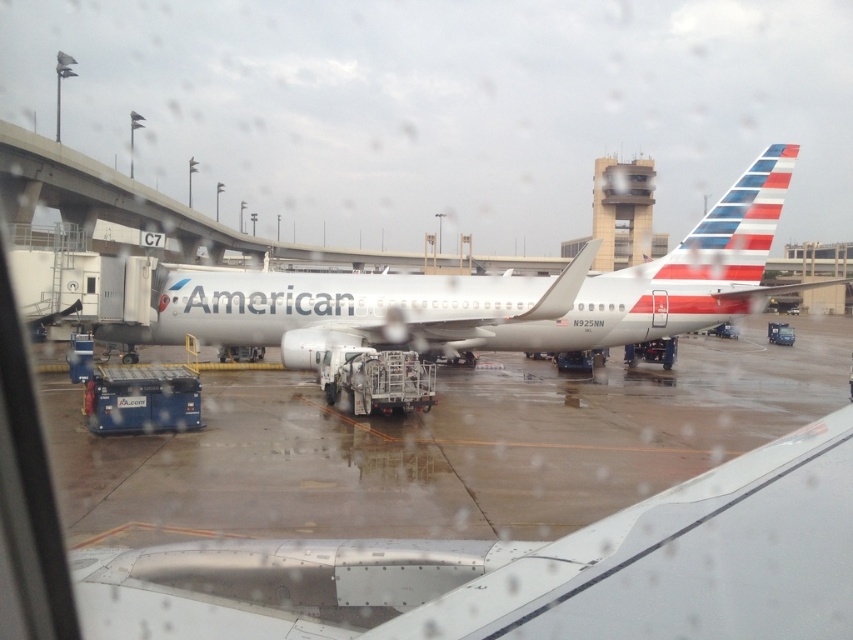
You are a passenger seated near the window on an airplane. You notice a silver metallic winglet at lower center outside your window. If your arms reach 2 meters, can you touch it by stretching your hand out the window?

The silver metallic winglet at lower center is 2.11 meters away from the viewer. Since your arms can only reach 2 meters, you cannot touch it as it is slightly farther than your reach.

Looking at this image, you are a flight attendant standing inside an airplane cabin. You look out the window and see a silver metallic winglet at lower center and a white glossy airplane at center. Which object appears shorter from your viewpoint?

The silver metallic winglet at lower center appears shorter than the white glossy airplane at center because it is not as tall as the white glossy airplane at center.

You are a pilot preparing for takeoff and notice a point on the aircraft. Based on the coordinates provided, can you identify what is located at point (527, 570)?

The point at (527, 570) corresponds to the silver metallic winglet at lower center.